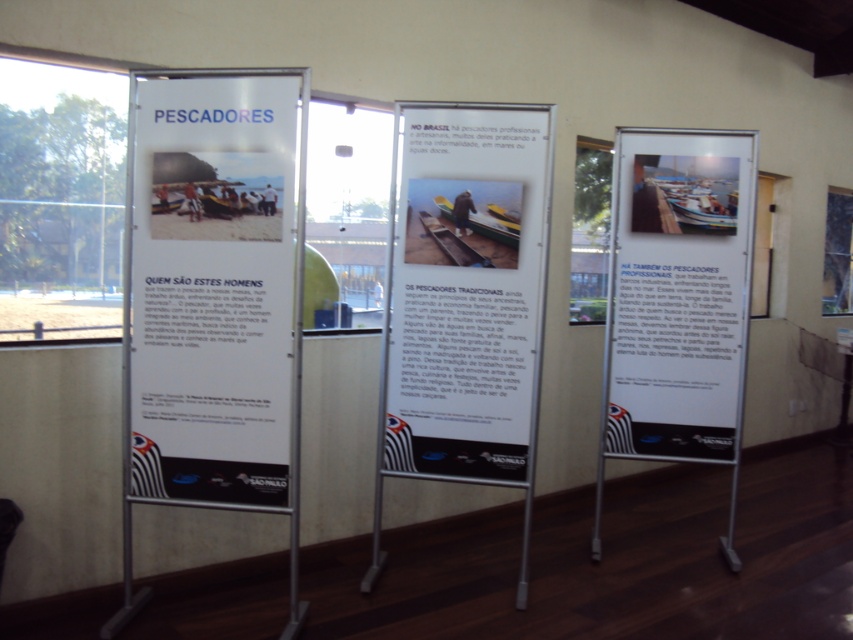
Question: Does matte paper poster at center come behind white paper poster at center?

Choices:
 (A) no
 (B) yes

Answer: (A)

Question: Which object is the closest to the white paper poster at center?

Choices:
 (A) matte paper poster at center
 (B) matte white poster at center

Answer: (A)

Question: Which object is the closest to the white paper poster at center?

Choices:
 (A) matte white poster at center
 (B) matte paper poster at center

Answer: (B)

Question: Can you confirm if matte white poster at center is wider than white paper poster at center?

Choices:
 (A) no
 (B) yes

Answer: (A)

Question: Does matte white poster at center appear over white paper poster at center?

Choices:
 (A) yes
 (B) no

Answer: (B)

Question: Which object appears farthest from the camera in this image?

Choices:
 (A) matte paper poster at center
 (B) matte white poster at center
 (C) white paper poster at center

Answer: (C)